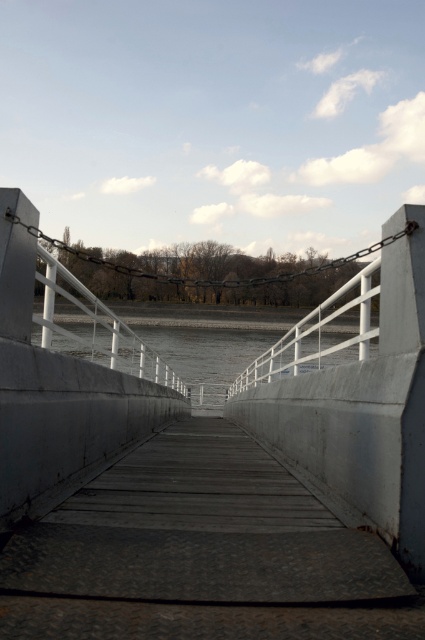
You are a delivery person carrying a large box that is 2 meters wide. You need to cross the smooth concrete bridge at center. Is there enough space between the white metal railings on both sides to pass through with your box?

The distance between the white metal railings on both sides is 2.05 meters, so the box that is 2 meters wide can pass through with some clearance.

You are standing at the starting point of the smooth concrete bridge at center and the gray concrete river at center. Which one extends further ahead?

The gray concrete river at center extends further ahead because it is longer than the smooth concrete bridge at center.

You are standing at the starting point of the bridge and want to reach a destination located at point (277, 371). There is an obstacle at point (229, 424). Which point should you avoid to ensure a safe path?

You should avoid point (229, 424) because it is closer to you than the destination point (277, 371). Since the obstacle is at the closer point, navigating around it would allow you to proceed safely toward the farther destination.